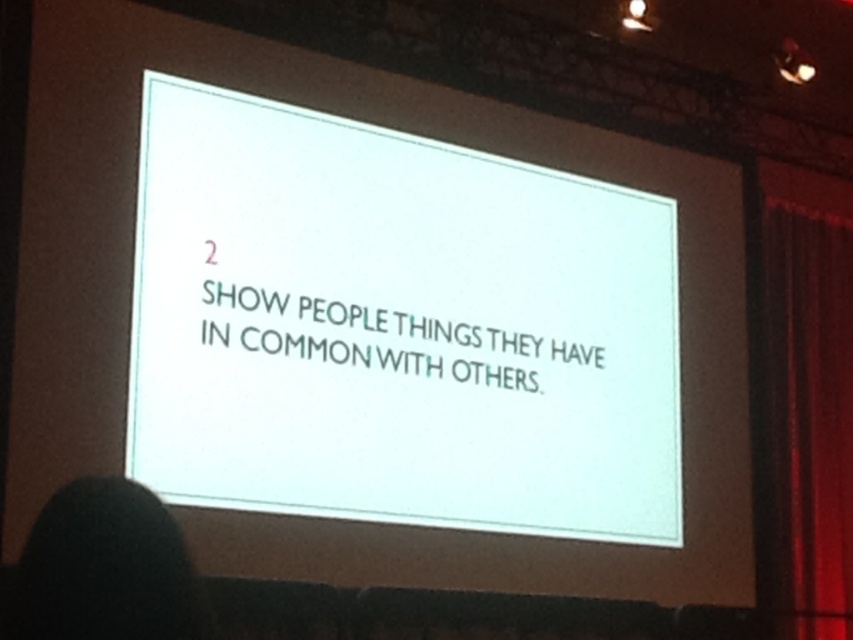
Is point (376, 380) positioned after point (129, 620)?

Yes.

Which is above, white paper at center or black hair at lower left?

Positioned higher is white paper at center.

Where is `white paper at center`? white paper at center is located at coordinates (396, 326).

Is point (485, 378) in front of point (843, 408)?

That is True.

How distant is white paper at center from red velvet curtain at right?

white paper at center is 26.54 feet from red velvet curtain at right.

At what (x,y) coordinates should I click in order to perform the action: click on white paper at center. Please return your answer as a coordinate pair (x, y). Looking at the image, I should click on (396, 326).

Does point (839, 246) lie behind point (148, 634)?

Yes, it is.

Looking at this image, can you confirm if red velvet curtain at right is positioned to the right of black hair at lower left?

Yes, red velvet curtain at right is to the right of black hair at lower left.

Where is `red velvet curtain at right`? The height and width of the screenshot is (640, 853). red velvet curtain at right is located at coordinates (805, 401).